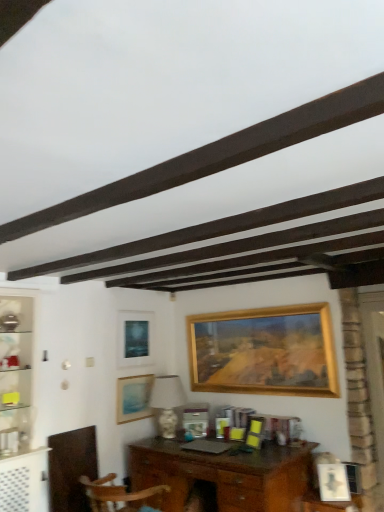
Question: Does wooden desk at center come behind wooden picture frame at center, which is the third picture frame in left-to-right order?

Choices:
 (A) yes
 (B) no

Answer: (B)

Question: Does wooden desk at center contain wooden picture frame at center, which is the third picture frame in left-to-right order?

Choices:
 (A) no
 (B) yes

Answer: (A)

Question: Does wooden desk at center have a larger size compared to wooden picture frame at center, placed as the 3th picture frame when sorted from right to left?

Choices:
 (A) no
 (B) yes

Answer: (B)

Question: From a real-world perspective, is wooden desk at center on wooden picture frame at center, which is the third picture frame in left-to-right order?

Choices:
 (A) no
 (B) yes

Answer: (A)

Question: From the image's perspective, is wooden desk at center located beneath wooden picture frame at center, placed as the 3th picture frame when sorted from right to left?

Choices:
 (A) no
 (B) yes

Answer: (B)

Question: In terms of width, does wooden picture frame at center, placed as the 3th picture frame when sorted from right to left, look wider or thinner when compared to gold wooden picture frame at center, the 2th picture frame in the right-to-left sequence?

Choices:
 (A) wide
 (B) thin

Answer: (B)

Question: From a real-world perspective, relative to gold wooden picture frame at center, the 2th picture frame in the right-to-left sequence, is wooden picture frame at center, which is the third picture frame in left-to-right order, vertically above or below?

Choices:
 (A) below
 (B) above

Answer: (A)

Question: Visually, is wooden picture frame at center, which is the third picture frame in left-to-right order, positioned to the left or to the right of gold wooden picture frame at center, the 2th picture frame in the right-to-left sequence?

Choices:
 (A) left
 (B) right

Answer: (A)

Question: Is wooden picture frame at center, which is the third picture frame in left-to-right order, taller or shorter than gold wooden picture frame at center, the 2th picture frame in the right-to-left sequence?

Choices:
 (A) short
 (B) tall

Answer: (A)

Question: Is gold wooden picture frame at center, the 2th picture frame in the right-to-left sequence, to the left or to the right of wooden desk at center in the image?

Choices:
 (A) right
 (B) left

Answer: (A)

Question: From their relative heights in the image, would you say gold wooden picture frame at center, the 2th picture frame in the right-to-left sequence, is taller or shorter than wooden desk at center?

Choices:
 (A) short
 (B) tall

Answer: (B)

Question: In terms of size, does gold wooden picture frame at center, the 2th picture frame in the right-to-left sequence, appear bigger or smaller than wooden desk at center?

Choices:
 (A) big
 (B) small

Answer: (B)

Question: Is gold wooden picture frame at center, the 2th picture frame in the right-to-left sequence, inside the boundaries of wooden desk at center, or outside?

Choices:
 (A) inside
 (B) outside

Answer: (B)

Question: Considering the positions of matte blue picture frame at lower left, which is counted as the 2th picture frame, starting from the left, and wooden picture frame at center, placed as the 3th picture frame when sorted from right to left, in the image, is matte blue picture frame at lower left, which is counted as the 2th picture frame, starting from the left, wider or thinner than wooden picture frame at center, placed as the 3th picture frame when sorted from right to left,?

Choices:
 (A) thin
 (B) wide

Answer: (A)

Question: From the image's perspective, is matte blue picture frame at lower left, which is counted as the 2th picture frame, starting from the left, located above or below wooden picture frame at center, placed as the 3th picture frame when sorted from right to left?

Choices:
 (A) below
 (B) above

Answer: (B)